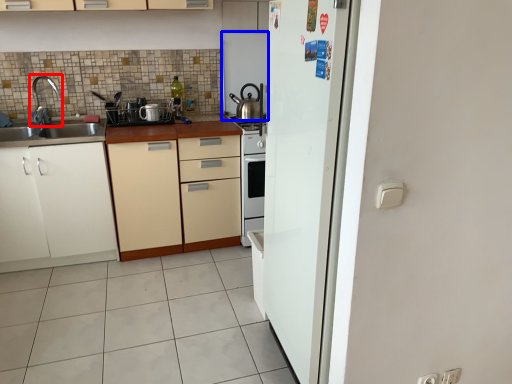
Question: Among these objects, which one is farthest to the camera, tap (highlighted by a red box) or appliance (highlighted by a blue box)?

Choices:
 (A) tap
 (B) appliance

Answer: (B)